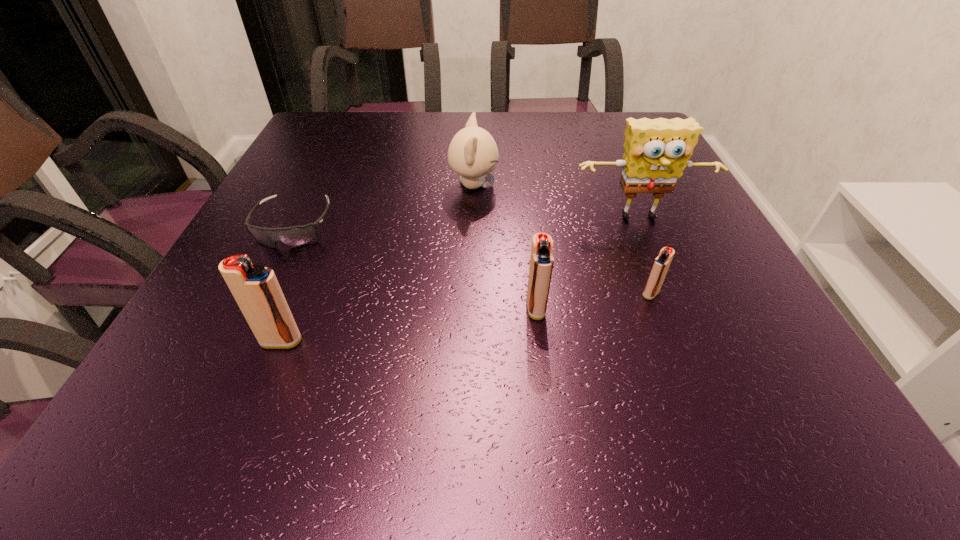
At what (x,y) coordinates should I click in order to perform the action: click on vacant space located on the right of the nearest object. Please return your answer as a coordinate pair (x, y). The width and height of the screenshot is (960, 540). Looking at the image, I should click on (540, 341).

Where is `vacant region located 0.320m on the back of the second tallest igniter`? The width and height of the screenshot is (960, 540). vacant region located 0.320m on the back of the second tallest igniter is located at coordinates (522, 194).

The height and width of the screenshot is (540, 960). Identify the location of free space located on the back of the rightmost igniter. (631, 241).

Find the location of a particular element. This screenshot has height=540, width=960. free space located on the face of the kitten is located at coordinates (579, 185).

You are a GUI agent. You are given a task and a screenshot of the screen. Output one action in this format:
    pyautogui.click(x=<x>, y=<y>)
    Task: Click on the free spot located on the face of the tallest object
    The height and width of the screenshot is (540, 960).
    Given the screenshot: What is the action you would take?
    pyautogui.click(x=656, y=255)

Find the location of a particular element. The width and height of the screenshot is (960, 540). vacant space positioned 0.060m on the lenses of the goggles is located at coordinates (271, 273).

The image size is (960, 540). In order to click on object located in the near edge section of the desktop in this screenshot , I will do `click(255, 288)`.

Locate an element on the screen. Image resolution: width=960 pixels, height=540 pixels. igniter that is at the left edge is located at coordinates (255, 288).

Identify the location of goggles present at the left edge. The image size is (960, 540). (295, 236).

Find the location of a particular element. object at the right edge is located at coordinates (657, 151).